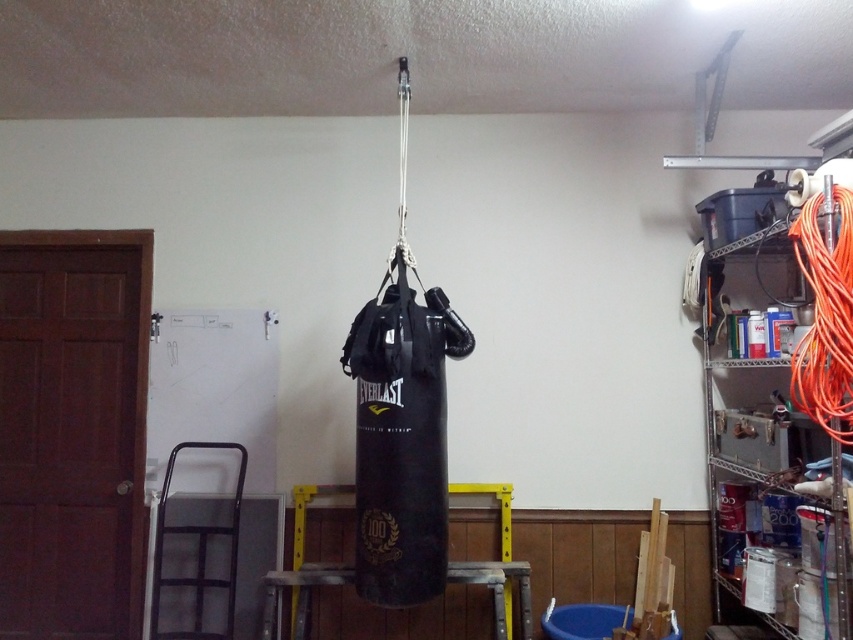
You are standing in the room and want to reach the orange cable at right without moving any objects. Can you safely step on the black Everlast punching bag to do so?

The orange cable at right is 7.02 feet away from the camera. Since the punching bag is centrally located and the cable is at the right, stepping on the punching bag might not reduce the distance enough to safely reach the cable without moving objects. It is not advisable to step on the punching bag for this purpose.

From the picture: You are organizing the garage and need to place a new tool box. The orange cable at right and the metallic wire shelving at right are in the way. Which object should you move first to access the area behind them?

The orange cable at right is positioned on the left side of the metallic wire shelving at right, so you should move the orange cable at right first to access the area behind both objects.